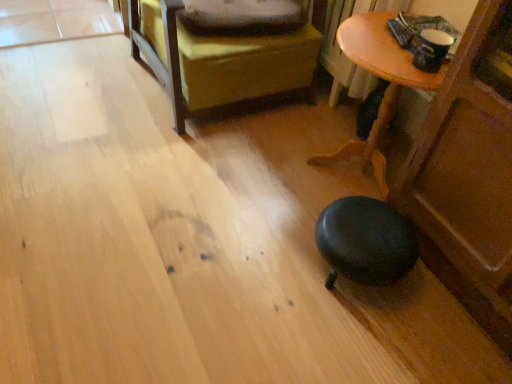
Question: Considering the relative sizes of leather ottoman at center and soft gray pillow at upper center in the image provided, is leather ottoman at center wider than soft gray pillow at upper center?

Choices:
 (A) no
 (B) yes

Answer: (B)

Question: Is leather ottoman at center closer to camera compared to soft gray pillow at upper center?

Choices:
 (A) yes
 (B) no

Answer: (A)

Question: Can you confirm if leather ottoman at center is taller than soft gray pillow at upper center?

Choices:
 (A) yes
 (B) no

Answer: (A)

Question: Is leather ottoman at center located outside soft gray pillow at upper center?

Choices:
 (A) yes
 (B) no

Answer: (A)

Question: Could you tell me if leather ottoman at center is facing soft gray pillow at upper center?

Choices:
 (A) no
 (B) yes

Answer: (B)

Question: Is leather ottoman at center to the right of soft gray pillow at upper center from the viewer's perspective?

Choices:
 (A) no
 (B) yes

Answer: (A)

Question: Considering the relative sizes of soft gray pillow at upper center and leather ottoman at center in the image provided, is soft gray pillow at upper center shorter than leather ottoman at center?

Choices:
 (A) no
 (B) yes

Answer: (B)

Question: Considering the relative sizes of soft gray pillow at upper center and leather ottoman at center in the image provided, is soft gray pillow at upper center wider than leather ottoman at center?

Choices:
 (A) no
 (B) yes

Answer: (A)

Question: Would you say soft gray pillow at upper center is a long distance from leather ottoman at center?

Choices:
 (A) no
 (B) yes

Answer: (A)

Question: Does soft gray pillow at upper center have a smaller size compared to leather ottoman at center?

Choices:
 (A) yes
 (B) no

Answer: (A)

Question: From the image's perspective, is soft gray pillow at upper center beneath leather ottoman at center?

Choices:
 (A) no
 (B) yes

Answer: (B)

Question: Is soft gray pillow at upper center behind leather ottoman at center?

Choices:
 (A) yes
 (B) no

Answer: (A)

Question: Is leather ottoman at center located within wooden table at lower right?

Choices:
 (A) yes
 (B) no

Answer: (B)